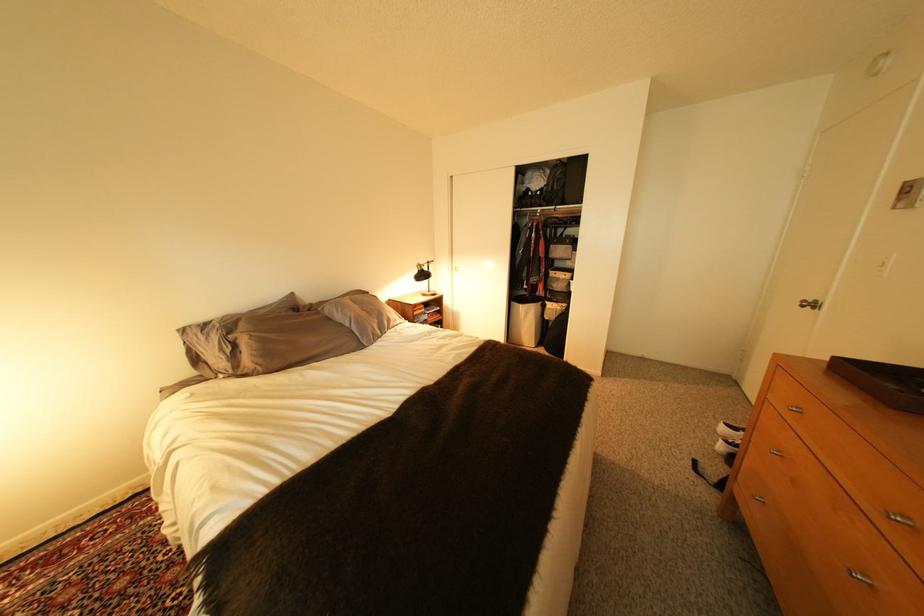
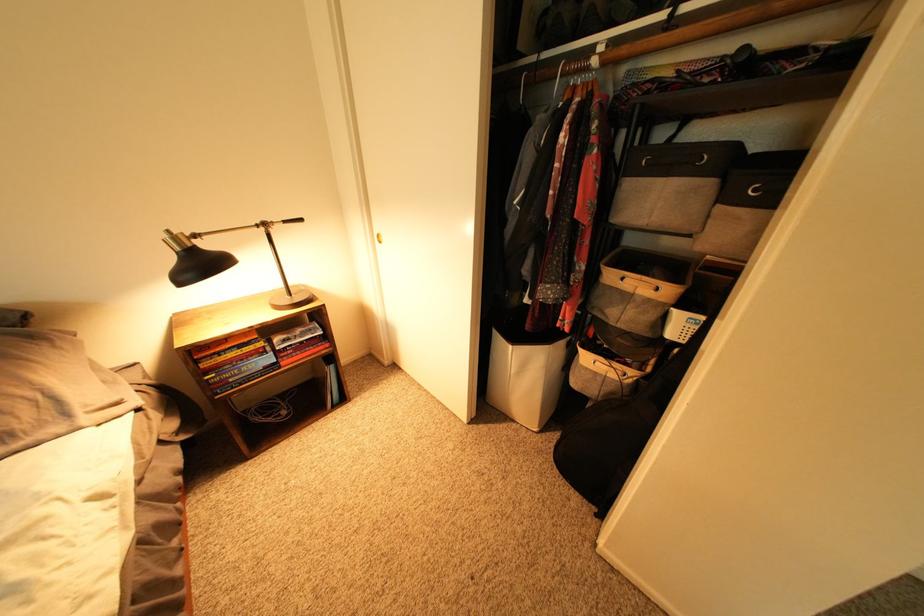
Question: The images are taken continuously from a first-person perspective. In which direction are you moving?

Choices:
 (A) Left
 (B) Right
 (C) Forward
 (D) Backward

Answer: (C)